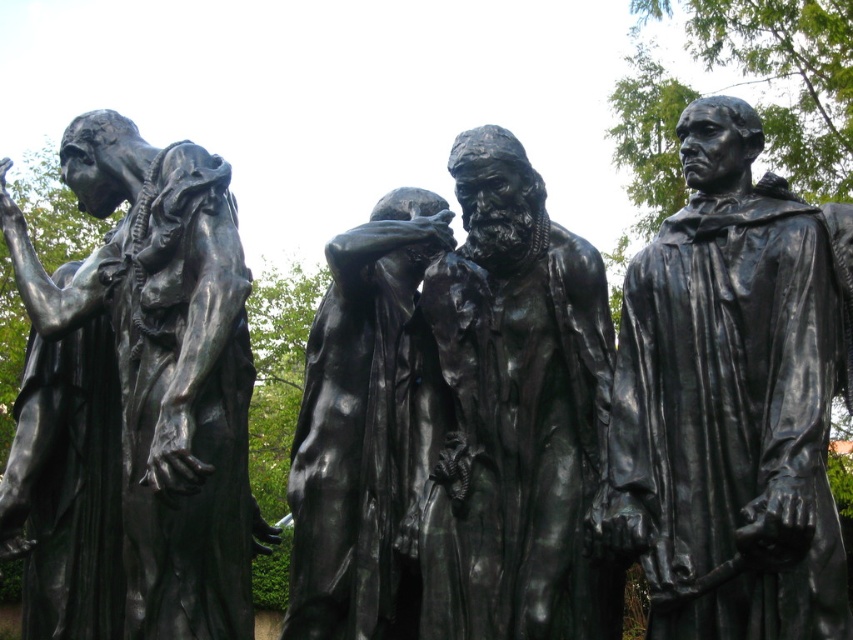
Question: Can you confirm if bronze statue at center is smaller than bronze statue at left?

Choices:
 (A) no
 (B) yes

Answer: (B)

Question: Is black bronze statue at center smaller than bronze statue at left?

Choices:
 (A) no
 (B) yes

Answer: (B)

Question: In this image, where is bronze statue at center located relative to black bronze statue at center?

Choices:
 (A) right
 (B) left

Answer: (A)

Question: Which of the following is the closest to the observer?

Choices:
 (A) bronze statue at center
 (B) black bronze statue at center

Answer: (A)

Question: Which point appears closest to the camera in this image?

Choices:
 (A) (619, 397)
 (B) (404, 244)
 (C) (238, 348)

Answer: (A)

Question: Which of the following is the farthest from the observer?

Choices:
 (A) (817, 541)
 (B) (525, 632)
 (C) (416, 244)
 (D) (15, 264)

Answer: (C)